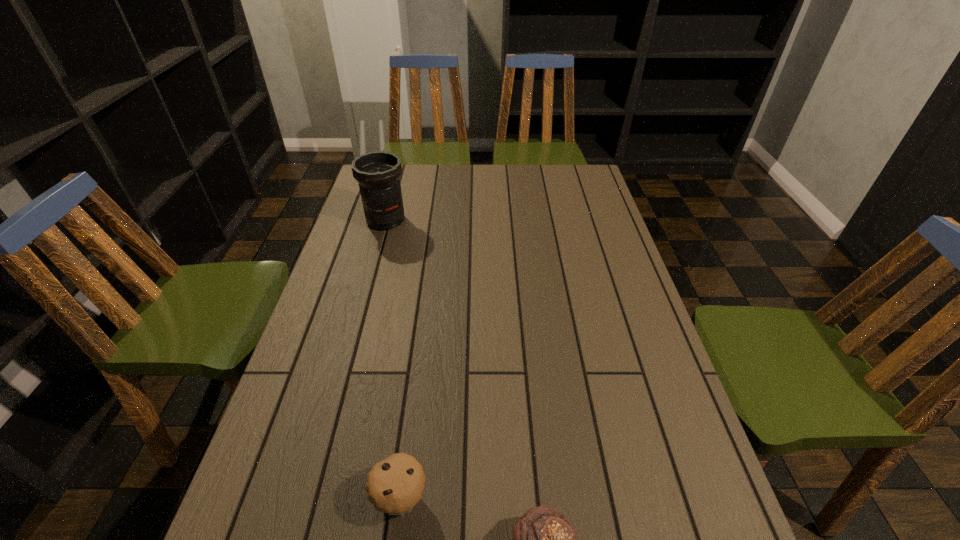
Find the location of a particular element. This screenshot has height=540, width=960. free space between the second object from left to right and the farthest object is located at coordinates (394, 359).

The image size is (960, 540). Find the location of `empty space between the left muffin and the tallest object`. empty space between the left muffin and the tallest object is located at coordinates (394, 359).

At what (x,y) coordinates should I click in order to perform the action: click on vacant point located between the second object from left to right and the telephoto lens. Please return your answer as a coordinate pair (x, y). Looking at the image, I should click on (394, 359).

Image resolution: width=960 pixels, height=540 pixels. What are the coordinates of `object identified as the closest to the telephoto lens` in the screenshot? It's located at (395, 485).

You are a GUI agent. You are given a task and a screenshot of the screen. Output one action in this format:
    pyautogui.click(x=<x>, y=<y>)
    Task: Click on the second closest object relative to the rightmost object
    Image resolution: width=960 pixels, height=540 pixels.
    Given the screenshot: What is the action you would take?
    pyautogui.click(x=378, y=174)

Find the location of a particular element. The height and width of the screenshot is (540, 960). vacant space that satisfies the following two spatial constraints: 1. on the front side of the leftmost object; 2. on the left side of the second object from right to left is located at coordinates (309, 498).

You are a GUI agent. You are given a task and a screenshot of the screen. Output one action in this format:
    pyautogui.click(x=<x>, y=<y>)
    Task: Click on the free spot that satisfies the following two spatial constraints: 1. on the front side of the second object from right to left; 2. on the right side of the leftmost object
    The height and width of the screenshot is (540, 960).
    Given the screenshot: What is the action you would take?
    pyautogui.click(x=309, y=498)